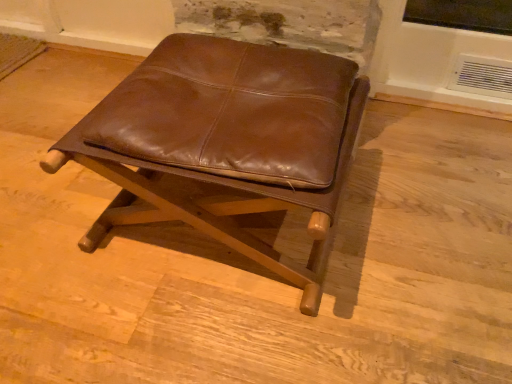
Image resolution: width=512 pixels, height=384 pixels. What are the coordinates of `free space to the left of brown leather stool at center` in the screenshot? It's located at (53, 215).